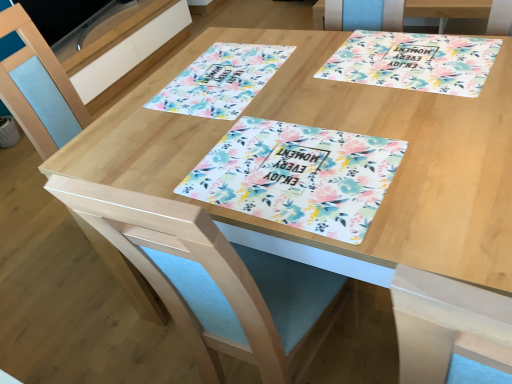
Question: Is floral paper placemat at upper right oriented towards floral paper placemat at center, which is counted as the 1th flyer, starting from the bottom?

Choices:
 (A) no
 (B) yes

Answer: (A)

Question: Considering the relative sizes of floral paper placemat at upper right and floral paper placemat at center, the 2th flyer positioned from the top, in the image provided, is floral paper placemat at upper right shorter than floral paper placemat at center, the 2th flyer positioned from the top,?

Choices:
 (A) no
 (B) yes

Answer: (A)

Question: Is floral paper placemat at upper right looking in the opposite direction of floral paper placemat at center, the second flyer when ordered from back to front?

Choices:
 (A) yes
 (B) no

Answer: (B)

Question: From the image's perspective, is floral paper placemat at upper right located above floral paper placemat at center, the 2th flyer positioned from the top?

Choices:
 (A) no
 (B) yes

Answer: (B)

Question: From a real-world perspective, is floral paper placemat at upper right positioned under floral paper placemat at center, positioned as the 1th flyer in front-to-back order, based on gravity?

Choices:
 (A) no
 (B) yes

Answer: (B)

Question: Does floral paper placemat at upper right appear on the right side of floral paper placemat at center, the 2th flyer positioned from the top?

Choices:
 (A) no
 (B) yes

Answer: (B)

Question: Is floral paper placemat at upper center, acting as the second flyer starting from the front, outside of floral paper placemat at upper right?

Choices:
 (A) yes
 (B) no

Answer: (A)

Question: Does floral paper placemat at upper center, acting as the second flyer starting from the front, have a larger size compared to floral paper placemat at upper right?

Choices:
 (A) yes
 (B) no

Answer: (B)

Question: From a real-world perspective, is floral paper placemat at upper center, marked as the 1th flyer in a top-to-bottom arrangement, physically below floral paper placemat at upper right?

Choices:
 (A) yes
 (B) no

Answer: (B)

Question: Is floral paper placemat at upper center, which is the 2th flyer in bottom-to-top order, wider than floral paper placemat at upper right?

Choices:
 (A) no
 (B) yes

Answer: (B)

Question: Is floral paper placemat at upper center, marked as the 1th flyer in a top-to-bottom arrangement, next to floral paper placemat at upper right?

Choices:
 (A) yes
 (B) no

Answer: (B)

Question: Considering the relative sizes of floral paper placemat at upper center, positioned as the first flyer in back-to-front order, and floral paper placemat at upper right in the image provided, is floral paper placemat at upper center, positioned as the first flyer in back-to-front order, shorter than floral paper placemat at upper right?

Choices:
 (A) no
 (B) yes

Answer: (B)

Question: Would you say floral paper placemat at upper center, positioned as the first flyer in back-to-front order, is part of blue fabric swivel chair at center's contents?

Choices:
 (A) yes
 (B) no

Answer: (B)